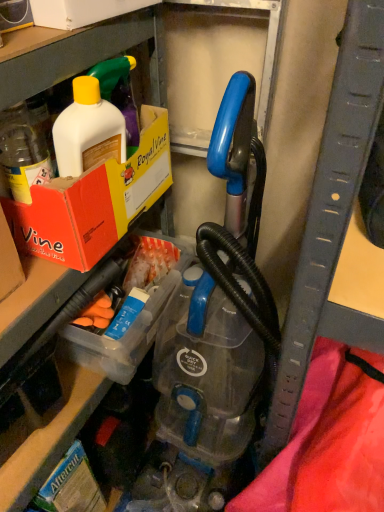
Question: Does orange cardboard box at upper left have a greater height compared to clear plastic container at center?

Choices:
 (A) yes
 (B) no

Answer: (A)

Question: Does orange cardboard box at upper left have a larger size compared to clear plastic container at center?

Choices:
 (A) no
 (B) yes

Answer: (B)

Question: Is orange cardboard box at upper left located outside clear plastic container at center?

Choices:
 (A) yes
 (B) no

Answer: (A)

Question: Can you confirm if orange cardboard box at upper left is positioned to the left of clear plastic container at center?

Choices:
 (A) no
 (B) yes

Answer: (B)

Question: From a real-world perspective, is orange cardboard box at upper left physically above clear plastic container at center?

Choices:
 (A) yes
 (B) no

Answer: (A)

Question: From a real-world perspective, is orange cardboard box at upper left located beneath clear plastic container at center?

Choices:
 (A) no
 (B) yes

Answer: (A)

Question: Are clear plastic container at center and orange cardboard box at upper left located far from each other?

Choices:
 (A) yes
 (B) no

Answer: (B)

Question: From the image's perspective, is clear plastic container at center over orange cardboard box at upper left?

Choices:
 (A) yes
 (B) no

Answer: (B)

Question: Can you confirm if clear plastic container at center is smaller than orange cardboard box at upper left?

Choices:
 (A) no
 (B) yes

Answer: (B)

Question: Is the position of clear plastic container at center more distant than that of orange cardboard box at upper left?

Choices:
 (A) no
 (B) yes

Answer: (B)

Question: Is clear plastic container at center to the left of orange cardboard box at upper left from the viewer's perspective?

Choices:
 (A) yes
 (B) no

Answer: (B)

Question: Is clear plastic container at center completely or partially outside of orange cardboard box at upper left?

Choices:
 (A) yes
 (B) no

Answer: (A)

Question: Visually, is orange cardboard box at upper left positioned to the left or to the right of clear plastic container at center?

Choices:
 (A) left
 (B) right

Answer: (A)